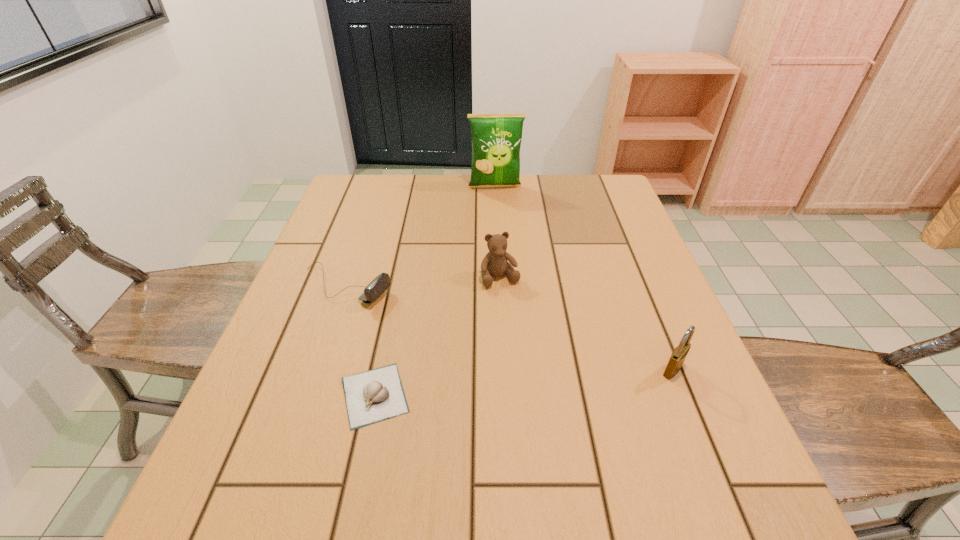
You are a GUI agent. You are given a task and a screenshot of the screen. Output one action in this format:
    pyautogui.click(x=<x>, y=<y>)
    Task: Click on the free space on the desktop that is between the shortest object and the rightmost object and is positioned on the front-facing side of the webcam
    
    Given the screenshot: What is the action you would take?
    pyautogui.click(x=566, y=379)

Where is `vacant spot on the desktop that is between the shortest object and the rightmost object and is positioned on the front-facing side of the tallest object`? vacant spot on the desktop that is between the shortest object and the rightmost object and is positioned on the front-facing side of the tallest object is located at coordinates (522, 382).

The width and height of the screenshot is (960, 540). What are the coordinates of `vacant spot on the desktop that is between the garlic and the padlock and is positioned on the front-facing side of the teddy bear` in the screenshot? It's located at (543, 381).